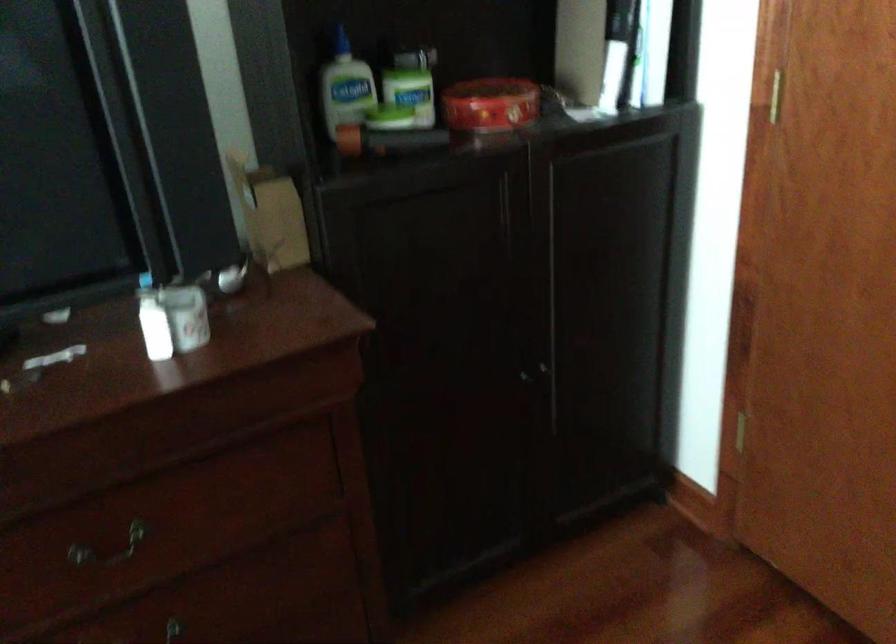
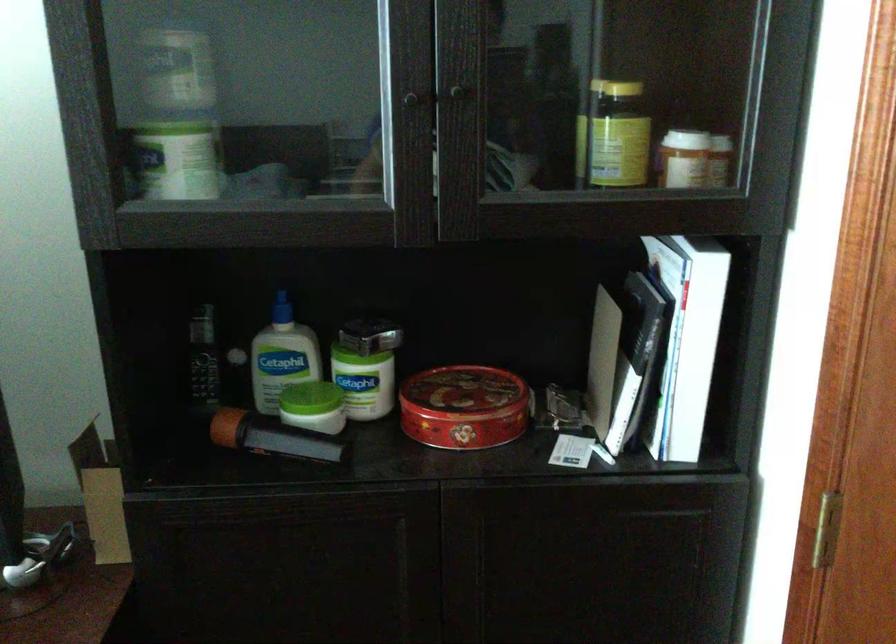
The point at (384, 136) is marked in the first image. Where is the corresponding point in the second image?

(268, 436)